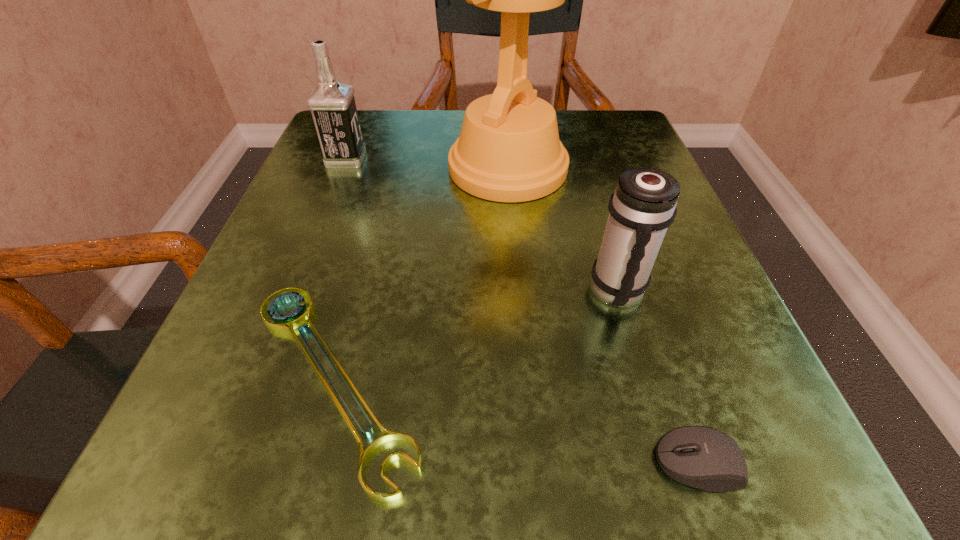
You are a GUI agent. You are given a task and a screenshot of the screen. Output one action in this format:
    pyautogui.click(x=<x>, y=<y>)
    Task: Click on the free region that satisfies the following two spatial constraints: 1. on the back side of the tallest object; 2. on the front label of the vodka
    This screenshot has width=960, height=540.
    Given the screenshot: What is the action you would take?
    pyautogui.click(x=507, y=159)

Find the location of a particular element. The image size is (960, 540). free location that satisfies the following two spatial constraints: 1. on the back side of the tallest object; 2. on the left side of the shortest object is located at coordinates (388, 168).

Locate an element on the screen. The width and height of the screenshot is (960, 540). vacant space that satisfies the following two spatial constraints: 1. on the front label of the vodka; 2. on the left side of the computer equipment is located at coordinates pyautogui.click(x=227, y=463).

This screenshot has height=540, width=960. Identify the location of free spot that satisfies the following two spatial constraints: 1. on the front label of the shortest object; 2. on the right side of the fourth shortest object. (259, 379).

Locate an element on the screen. The image size is (960, 540). vacant region that satisfies the following two spatial constraints: 1. on the side with the handle of the thermos bottle; 2. on the right side of the computer equipment is located at coordinates (668, 463).

I want to click on blank space that satisfies the following two spatial constraints: 1. on the back side of the award; 2. on the front label of the vodka, so click(x=507, y=159).

Identify the location of vacant space that satisfies the following two spatial constraints: 1. on the front label of the vodka; 2. on the right side of the wrench. This screenshot has width=960, height=540. (259, 379).

Find the location of a particular element. This screenshot has height=540, width=960. vacant area that satisfies the following two spatial constraints: 1. on the front label of the vodka; 2. on the back side of the shortest object is located at coordinates (259, 379).